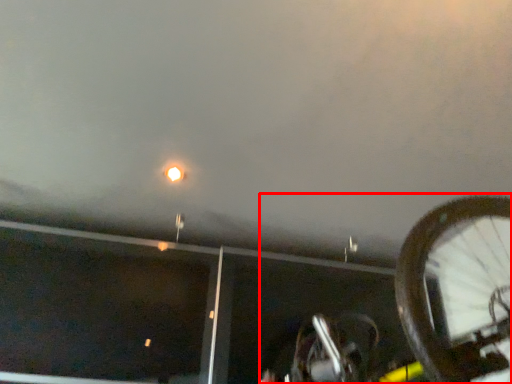
Question: From the image's perspective, considering the relative positions of bicycle (annotated by the red box) and street light in the image provided, where is bicycle (annotated by the red box) located with respect to the staircase?

Choices:
 (A) above
 (B) below

Answer: (B)